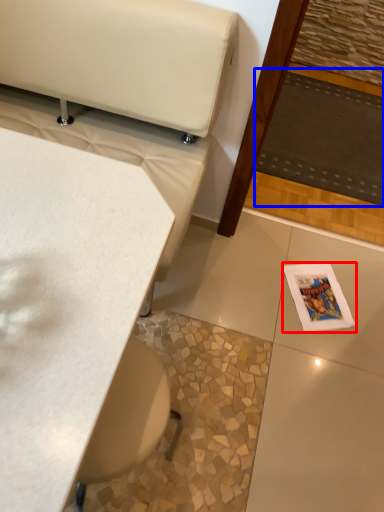
Question: Among these objects, which one is nearest to the camera, magazine (highlighted by a red box) or mat (highlighted by a blue box)?

Choices:
 (A) magazine
 (B) mat

Answer: (A)